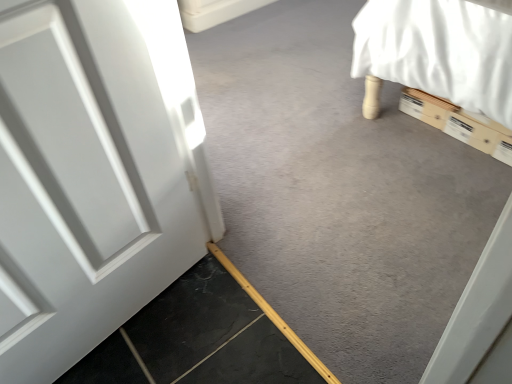
Question: From their relative heights in the image, would you say smooth gray concrete at bottom left, which is counted as the second concrete, starting from the top, is taller or shorter than smooth gray concrete at lower left, the second concrete in the bottom-to-top sequence?

Choices:
 (A) tall
 (B) short

Answer: (A)

Question: From the image's perspective, is smooth gray concrete at bottom left, acting as the first concrete starting from the bottom, positioned above or below smooth gray concrete at lower left, the first concrete in the top-to-bottom sequence?

Choices:
 (A) above
 (B) below

Answer: (B)

Question: From a real-world perspective, is smooth gray concrete at bottom left, acting as the first concrete starting from the bottom, physically located above or below smooth gray concrete at lower left, the first concrete in the top-to-bottom sequence?

Choices:
 (A) above
 (B) below

Answer: (A)

Question: From a real-world perspective, is smooth gray concrete at lower left, the second concrete in the bottom-to-top sequence, physically located above or below smooth gray concrete at bottom left, which is counted as the second concrete, starting from the top?

Choices:
 (A) below
 (B) above

Answer: (A)

Question: Considering the positions of smooth gray concrete at lower left, the second concrete in the bottom-to-top sequence, and smooth gray concrete at bottom left, which is counted as the second concrete, starting from the top, in the image, is smooth gray concrete at lower left, the second concrete in the bottom-to-top sequence, wider or thinner than smooth gray concrete at bottom left, which is counted as the second concrete, starting from the top,?

Choices:
 (A) thin
 (B) wide

Answer: (B)

Question: In the image, is smooth gray concrete at lower left, the first concrete in the top-to-bottom sequence, positioned in front of or behind smooth gray concrete at bottom left, acting as the first concrete starting from the bottom?

Choices:
 (A) behind
 (B) front

Answer: (A)

Question: Considering the positions of smooth gray concrete at lower left, the first concrete in the top-to-bottom sequence, and smooth gray concrete at bottom left, acting as the first concrete starting from the bottom, in the image, is smooth gray concrete at lower left, the first concrete in the top-to-bottom sequence, bigger or smaller than smooth gray concrete at bottom left, acting as the first concrete starting from the bottom,?

Choices:
 (A) small
 (B) big

Answer: (B)